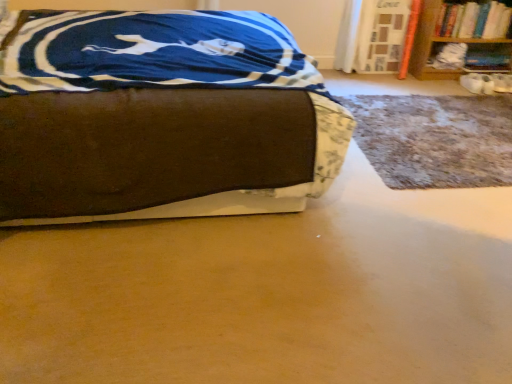
Question: From the image's perspective, relative to hardcover book at upper right, is brown fabric bed at center above or below?

Choices:
 (A) above
 (B) below

Answer: (B)

Question: From their relative heights in the image, would you say brown fabric bed at center is taller or shorter than hardcover book at upper right?

Choices:
 (A) tall
 (B) short

Answer: (A)

Question: Which object is the closest to the hardcover book at upper right?

Choices:
 (A) brown fabric bed at center
 (B) wooden bookshelf at upper right

Answer: (B)

Question: Which object is the farthest from the brown fabric bed at center?

Choices:
 (A) wooden bookshelf at upper right
 (B) hardcover book at upper right

Answer: (B)